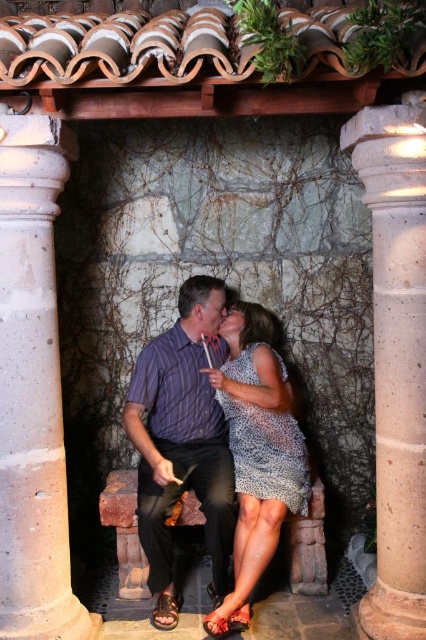
You are a photographer taking a picture of the scene. You notice two points in the image at coordinates point (236,625) and point (180,604). Which point is closer to your camera?

Point (236,625) is closer to the camera than point (180,604).